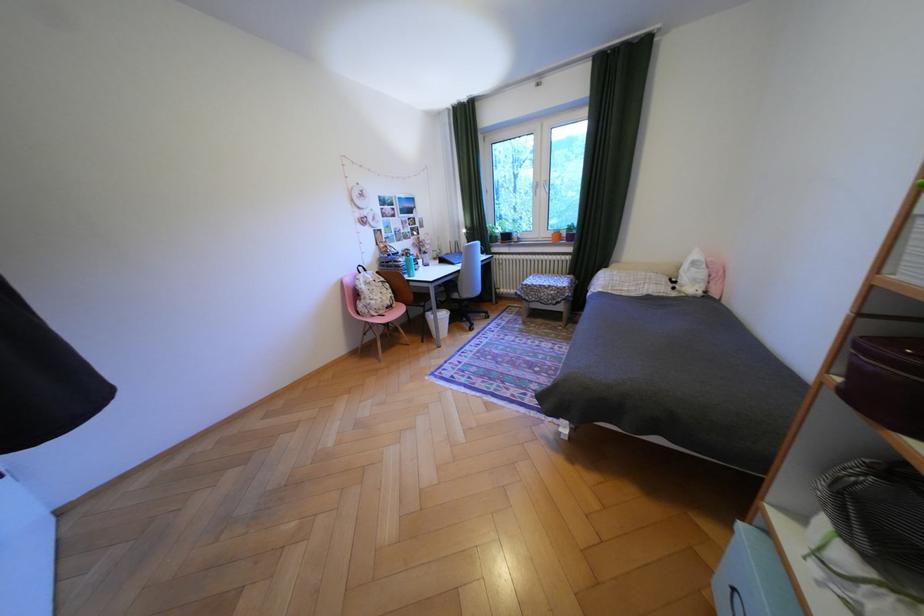
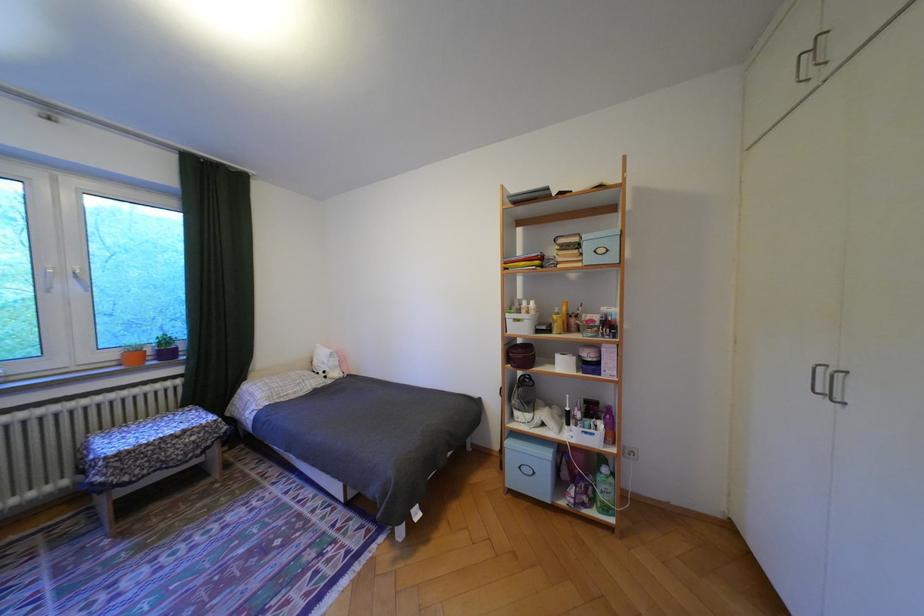
The point at (562, 233) is marked in the first image. Where is the corresponding point in the second image?

(124, 355)